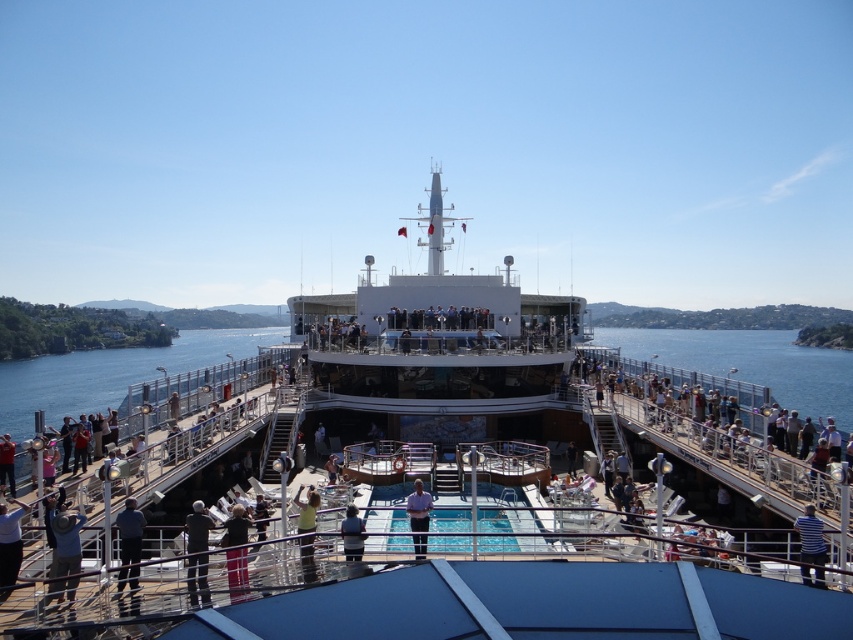
Who is positioned more to the left, dark blue shirt at center or blue shirt at center?

dark blue shirt at center

Who is higher up, dark blue shirt at center or blue shirt at center?

blue shirt at center is higher up.

What do you see at coordinates (129, 544) in the screenshot? I see `dark blue shirt at center` at bounding box center [129, 544].

The width and height of the screenshot is (853, 640). In order to click on dark blue shirt at center in this screenshot , I will do `click(129, 544)`.

Based on the photo, can you confirm if light brown leather jacket at lower left is positioned above red shirt at left?

No.

Consider the image. Can you confirm if light brown leather jacket at lower left is wider than red shirt at left?

Incorrect, light brown leather jacket at lower left's width does not surpass red shirt at left's.

The image size is (853, 640). In order to click on light brown leather jacket at lower left in this screenshot , I will do `click(67, 552)`.

Which is above, white glossy ship at center or blue shirt at center?

white glossy ship at center is higher up.

Is white glossy ship at center further to the viewer compared to blue shirt at center?

No, white glossy ship at center is in front of blue shirt at center.

The image size is (853, 640). In order to click on white glossy ship at center in this screenshot , I will do tap(463, 385).

Identify the location of white glossy ship at center. (463, 385).